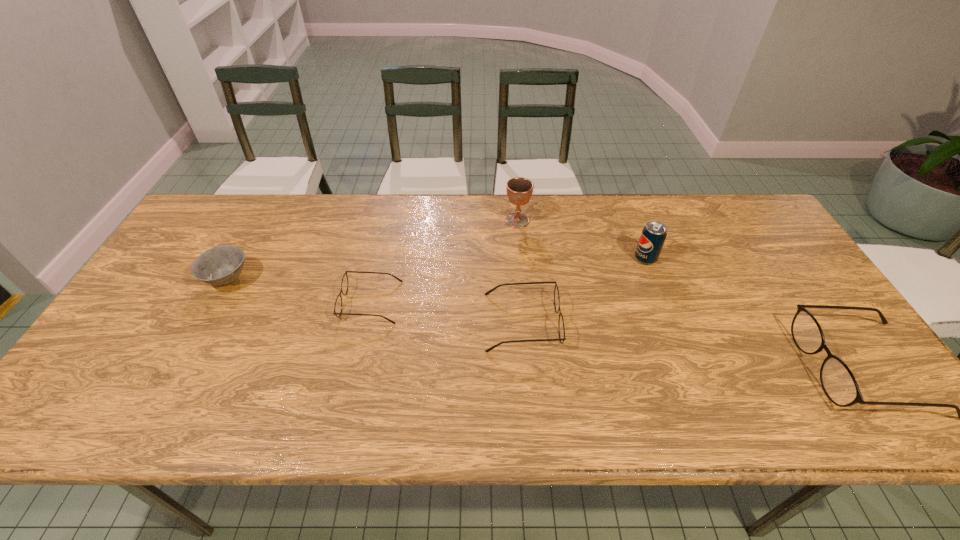
In order to click on object that is the closest to the fifth shortest object in this screenshot , I will do `click(561, 329)`.

Where is `spectacles object that ranks as the closest to the leftmost object`? spectacles object that ranks as the closest to the leftmost object is located at coordinates (344, 284).

I want to click on spectacles that can be found as the closest to the farthest object, so click(561, 329).